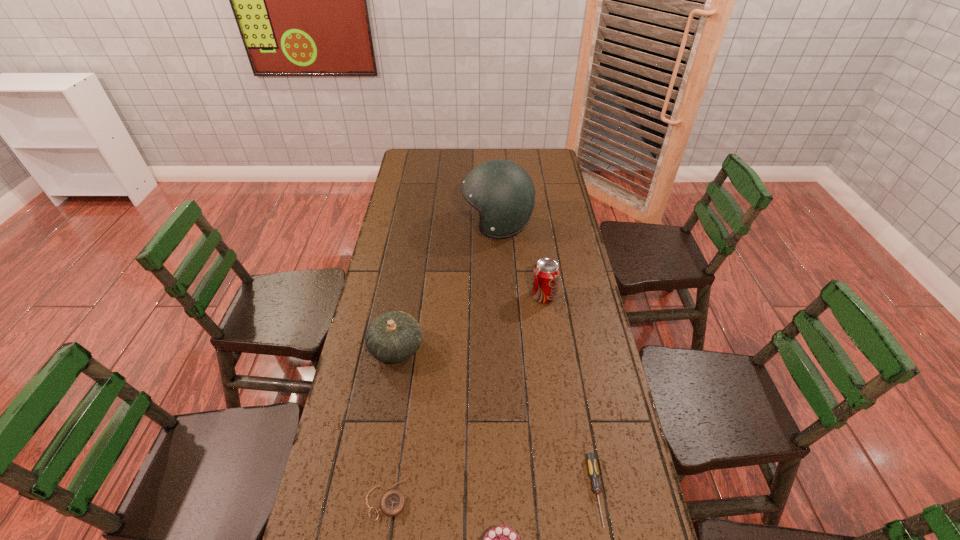
Identify the location of free area in between the third farthest object and the rightmost object. This screenshot has height=540, width=960. (496, 420).

Find the location of a particular element. This screenshot has height=540, width=960. free spot between the fifth tallest object and the farthest object is located at coordinates (546, 358).

This screenshot has height=540, width=960. What are the coordinates of `vacant area that lies between the gourd and the rightmost object` in the screenshot? It's located at (496, 420).

Where is `vacant point located between the football helmet and the soda can`? vacant point located between the football helmet and the soda can is located at coordinates (520, 260).

Where is `vacant space in between the fifth tallest object and the fifth nearest object`? vacant space in between the fifth tallest object and the fifth nearest object is located at coordinates (570, 394).

You are a GUI agent. You are given a task and a screenshot of the screen. Output one action in this format:
    pyautogui.click(x=<x>, y=<y>)
    Task: Click on the object that ranks as the second closest to the chocolate cake
    
    Given the screenshot: What is the action you would take?
    pyautogui.click(x=591, y=457)

At what (x,y) coordinates should I click in order to perform the action: click on object that is the nearest to the third farthest object. Please return your answer as a coordinate pair (x, y). This screenshot has height=540, width=960. Looking at the image, I should click on (392, 503).